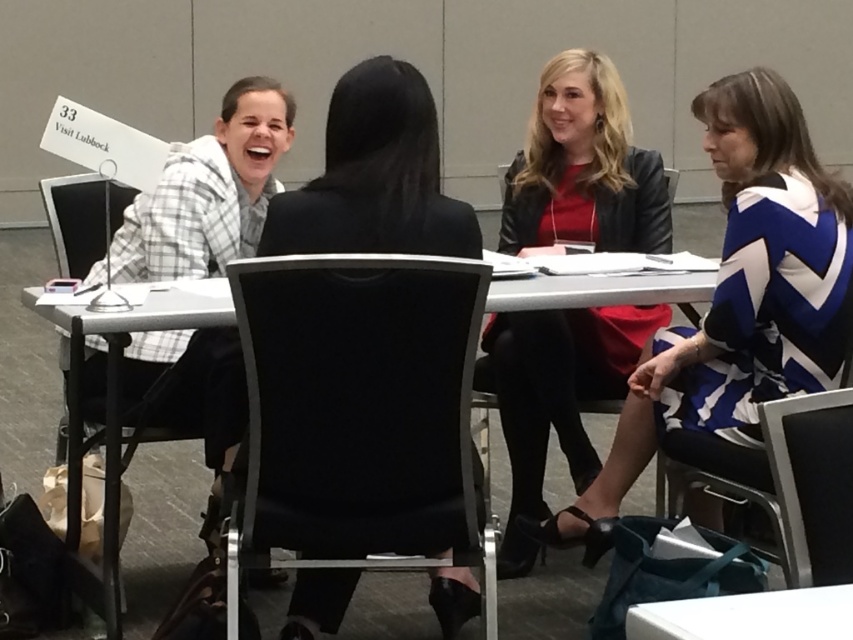
Question: Is blue and white zigzag dress at center bigger than black leather chair at lower right?

Choices:
 (A) no
 (B) yes

Answer: (B)

Question: Which object appears farthest from the camera in this image?

Choices:
 (A) white plastic table at center
 (B) black leather chair at lower right
 (C) blue and white zigzag dress at center

Answer: (C)

Question: Which point is closer to the camera?

Choices:
 (A) white glossy table at lower center
 (B) black fabric chair at center

Answer: (A)

Question: Can you confirm if matte black dress at center is smaller than black leather chair at lower right?

Choices:
 (A) yes
 (B) no

Answer: (B)

Question: Is black fabric chair at center closer to the viewer compared to black leather chair at lower right?

Choices:
 (A) yes
 (B) no

Answer: (B)

Question: Estimate the real-world distances between objects in this image. Which object is closer to the black leather chair at lower right?

Choices:
 (A) black fabric chair at center
 (B) white plastic table at center

Answer: (B)